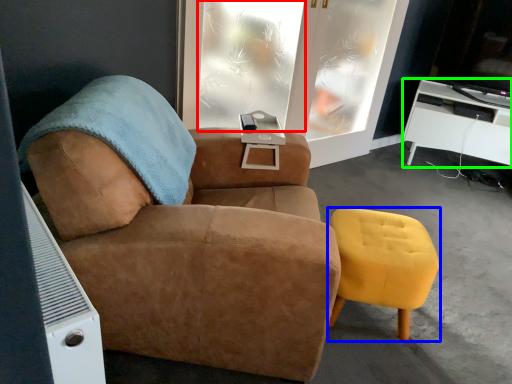
Question: Estimate the real-world distances between objects in this image. Which object is farther from window (highlighted by a red box), stool (highlighted by a blue box) or desk (highlighted by a green box)?

Choices:
 (A) stool
 (B) desk

Answer: (B)